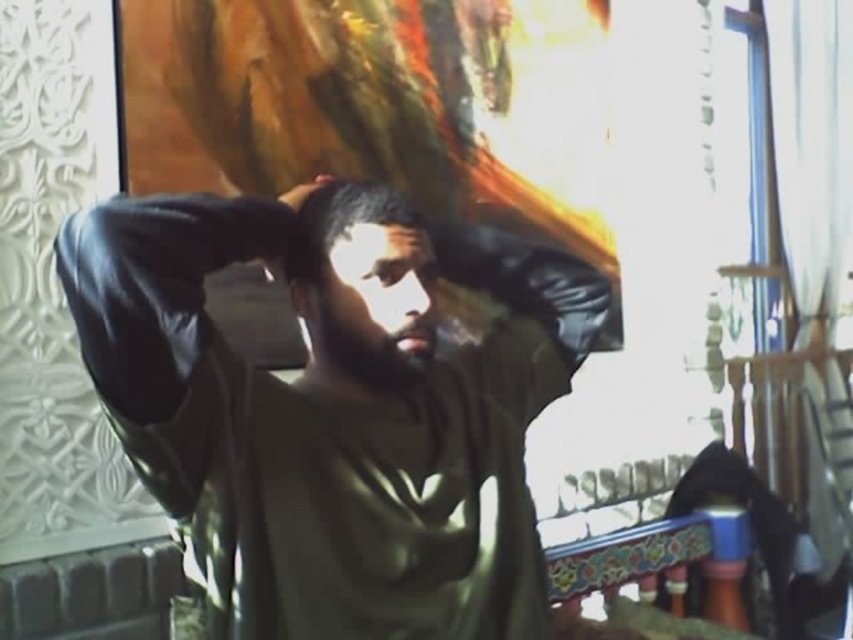
Question: Can you confirm if dark green fabric at center is smaller than dark matte hair at center?

Choices:
 (A) yes
 (B) no

Answer: (B)

Question: From the image, what is the correct spatial relationship of dark green fabric at center in relation to black leather hand at upper center?

Choices:
 (A) left
 (B) right

Answer: (B)

Question: Which of the following is the farthest from the observer?

Choices:
 (A) black leather hand at upper center
 (B) dark matte hair at center
 (C) leather jacket at center
 (D) dark green fabric at center

Answer: (A)

Question: Is leather jacket at center positioned before dark green fabric at center?

Choices:
 (A) no
 (B) yes

Answer: (B)

Question: Which point is closer to the camera?

Choices:
 (A) black leather hand at upper center
 (B) dark matte hair at center

Answer: (B)

Question: Which of the following is the farthest from the observer?

Choices:
 (A) dark matte hair at center
 (B) leather jacket at center
 (C) black leather hand at upper center
 (D) dark green fabric at center

Answer: (C)